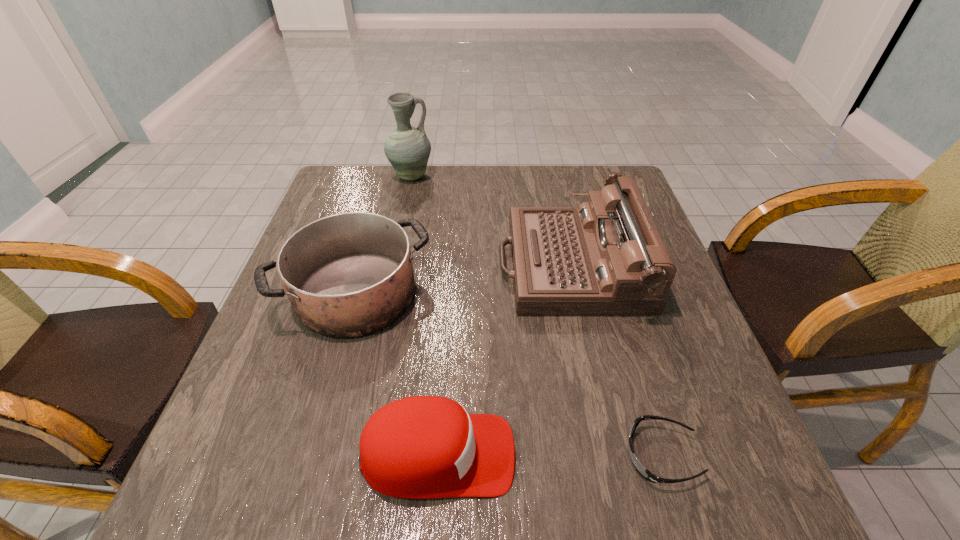
You are a GUI agent. You are given a task and a screenshot of the screen. Output one action in this format:
    pyautogui.click(x=<x>, y=<y>)
    Task: Click on the unoccupied area between the typewriter and the saucepan
    This screenshot has height=540, width=960.
    Given the screenshot: What is the action you would take?
    pyautogui.click(x=464, y=279)

Locate an element on the screen. free space between the baseball cap and the sunglasses is located at coordinates (549, 455).

I want to click on vacant space that is in between the sunglasses and the pitcher, so click(536, 315).

Identify the location of empty space that is in between the sunglasses and the farthest object. (536, 315).

This screenshot has height=540, width=960. Find the location of `blank region between the second tallest object and the fourth tallest object`. blank region between the second tallest object and the fourth tallest object is located at coordinates (504, 360).

Find the location of a particular element. This screenshot has height=540, width=960. empty location between the sunglasses and the second shortest object is located at coordinates (549, 455).

This screenshot has height=540, width=960. What are the coordinates of `free space between the second tallest object and the fourth tallest object` in the screenshot? It's located at (504, 360).

Where is `the fourth closest object to the second shortest object`? The width and height of the screenshot is (960, 540). the fourth closest object to the second shortest object is located at coordinates (407, 148).

Locate an element on the screen. object that is the third closest one to the farthest object is located at coordinates (422, 447).